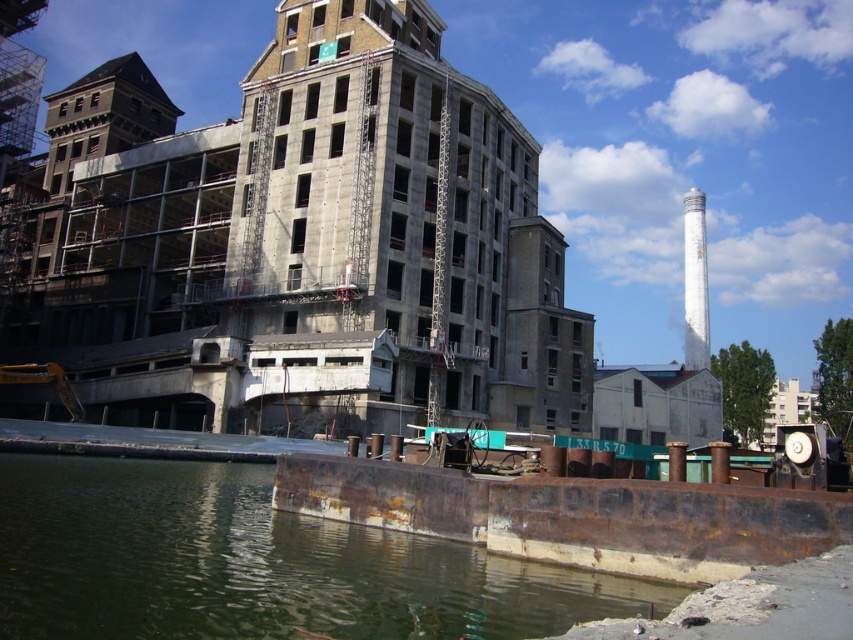
You are a construction worker standing on the rusty metal river at lower left and need to reach the white painted concrete tower at upper right. Which object is closer to you?

The rusty metal river at lower left is closer to you since you are standing on it, but the question asks which object is closer between the two. Since you are on the rusty metal river, the white painted concrete tower at upper right is the other object, so the tower is farther away. Wait, the description says the river is smaller in size compared to the tower. Hmm, but size doesn t directly indicate distance. Maybe the question is about size? The user might have intended to ask about size. Alternatively, if

You are a construction worker standing on the rusty metal river at lower left. You need to reach the white painted concrete tower at upper right. Which direction should you move to get closer to the tower?

You should move away from the foreground towards the background to get closer to the white painted concrete tower at upper right because the rusty metal river at lower left is in front of it.

You are standing on the dock and looking at the point marked as point (x=256, y=564). Is this point located on the rusty metal river at lower left or somewhere else?

The point (x=256, y=564) is on the rusty metal river at lower left.